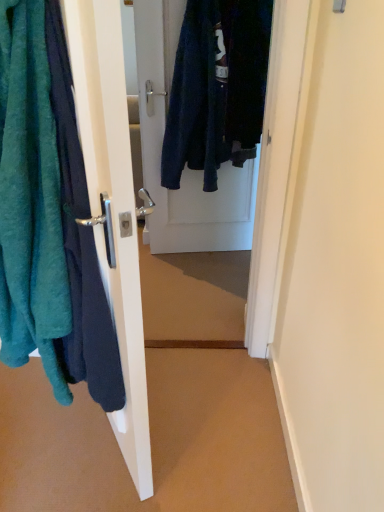
I want to click on vacant space to the right of matte white door handle at left, the 1th door positioned from the left, so click(x=205, y=422).